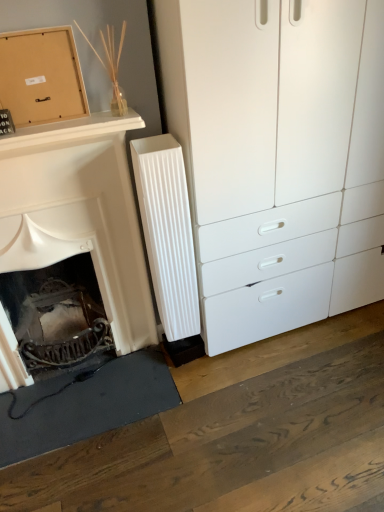
Identify the location of space that is in front of matte cardboard box at upper left. This screenshot has height=512, width=384. (33, 128).